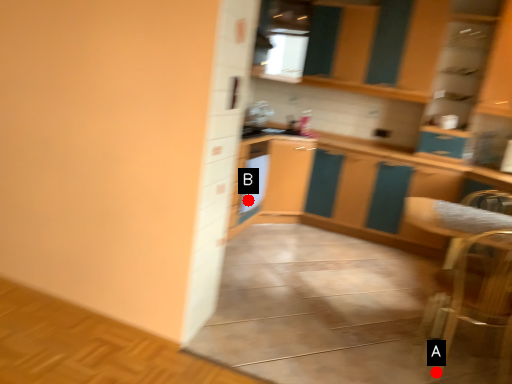
Question: Two points are circled on the image, labeled by A and B beside each circle. Which point is closer to the camera taking this photo?

Choices:
 (A) A is closer
 (B) B is closer

Answer: (A)